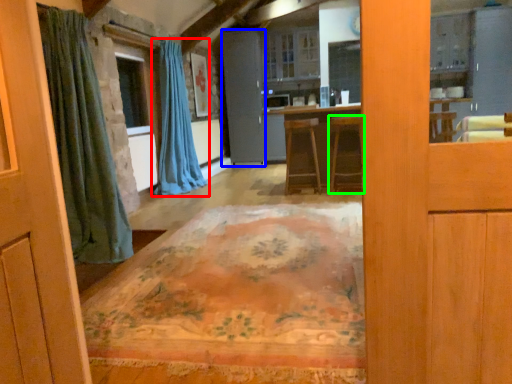
Question: Which object is positioned closest to curtain (highlighted by a red box)? Select from screen door (highlighted by a blue box) and furniture (highlighted by a green box).

Choices:
 (A) screen door
 (B) furniture

Answer: (A)